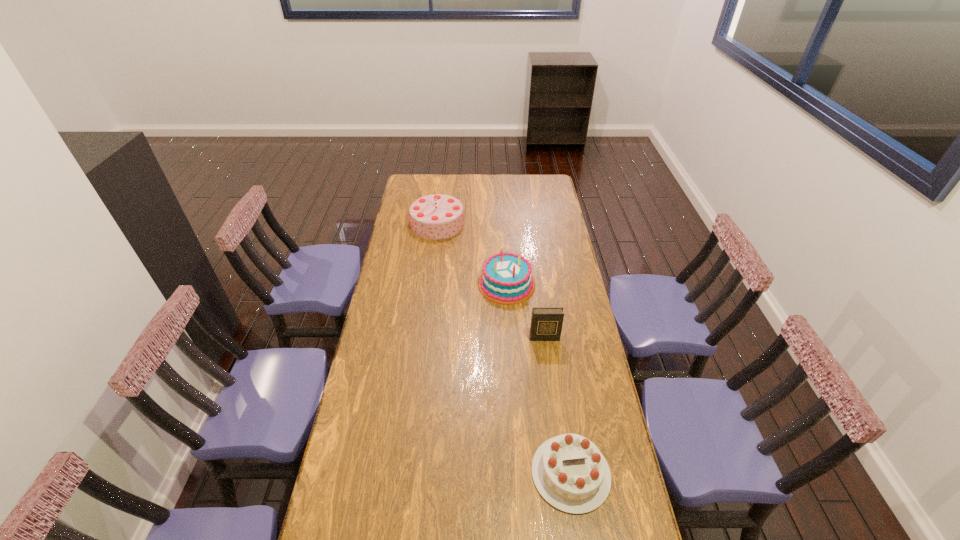
I want to click on the farthest object, so (x=437, y=216).

This screenshot has height=540, width=960. In order to click on the leftmost object in this screenshot , I will do `click(437, 216)`.

Find the location of a particular element. the second farthest object is located at coordinates (506, 279).

Where is `the second farthest birthday cake`? the second farthest birthday cake is located at coordinates (506, 279).

Locate an element on the screen. The height and width of the screenshot is (540, 960). diary is located at coordinates (546, 323).

The width and height of the screenshot is (960, 540). In order to click on the nearest birthday cake in this screenshot , I will do `click(571, 474)`.

What are the coordinates of `the shortest object` in the screenshot? It's located at (571, 474).

Locate an element on the screen. vacant space situated on the front of the farthest object is located at coordinates (433, 263).

The height and width of the screenshot is (540, 960). Identify the location of vacant region located on the left of the second nearest birthday cake. (454, 284).

You are a GUI agent. You are given a task and a screenshot of the screen. Output one action in this format:
    pyautogui.click(x=<x>, y=<y>)
    Task: Click on the vacant position located on the front cover of the second nearest object
    
    Given the screenshot: What is the action you would take?
    [x=550, y=383]